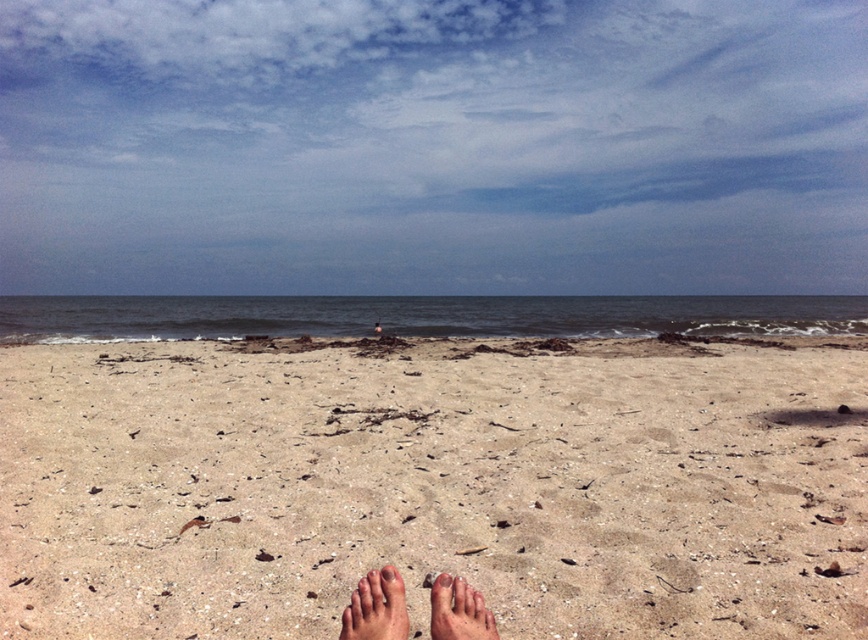
Is point (538, 522) closer to camera compared to point (465, 628)?

No, (538, 522) is further to viewer.

Who is positioned more to the left, light beige sand at center or skinny bare feet at lower center?

From the viewer's perspective, light beige sand at center appears more on the left side.

I want to click on light beige sand at center, so point(434,486).

Between point (388, 628) and point (388, 573), which one is positioned in front?

Point (388, 628)

The height and width of the screenshot is (640, 868). What do you see at coordinates (375, 609) in the screenshot?
I see `light brown skin at lower center` at bounding box center [375, 609].

Is point (345, 628) less distant than point (383, 568)?

That is True.

You are a GUI agent. You are given a task and a screenshot of the screen. Output one action in this format:
    pyautogui.click(x=<x>, y=<y>)
    Task: Click on the light brown skin at lower center
    The height and width of the screenshot is (640, 868).
    Given the screenshot: What is the action you would take?
    pyautogui.click(x=375, y=609)

Who is shorter, skinny bare feet at lower center or brown rough toe at lower center?

With less height is brown rough toe at lower center.

Is point (446, 596) farther from viewer compared to point (392, 573)?

No, (446, 596) is in front of (392, 573).

Between point (367, 589) and point (389, 579), which one is positioned in front?

Point (367, 589) is more forward.

Where is `skinny bare feet at lower center`? Image resolution: width=868 pixels, height=640 pixels. skinny bare feet at lower center is located at coordinates (375, 609).